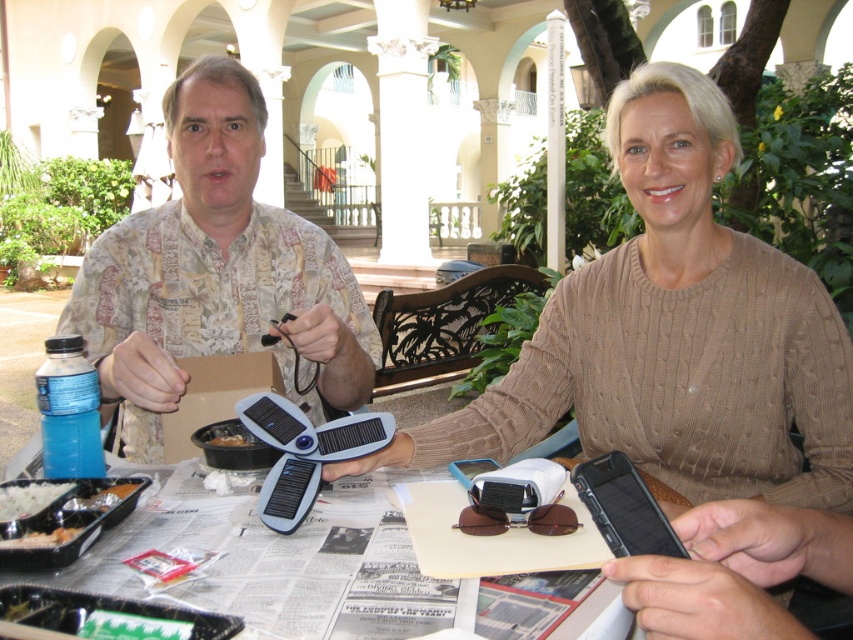
You are standing in the scene and want to take a photo of the point at coordinates [717,227]. Is the point within your camera frame if your camera has a 1.5 meter focal length?

The point at coordinates [717,227] is 1.29 meters away from the camera, which is within the 1.5 meter focal length, so yes, it will be in the frame.